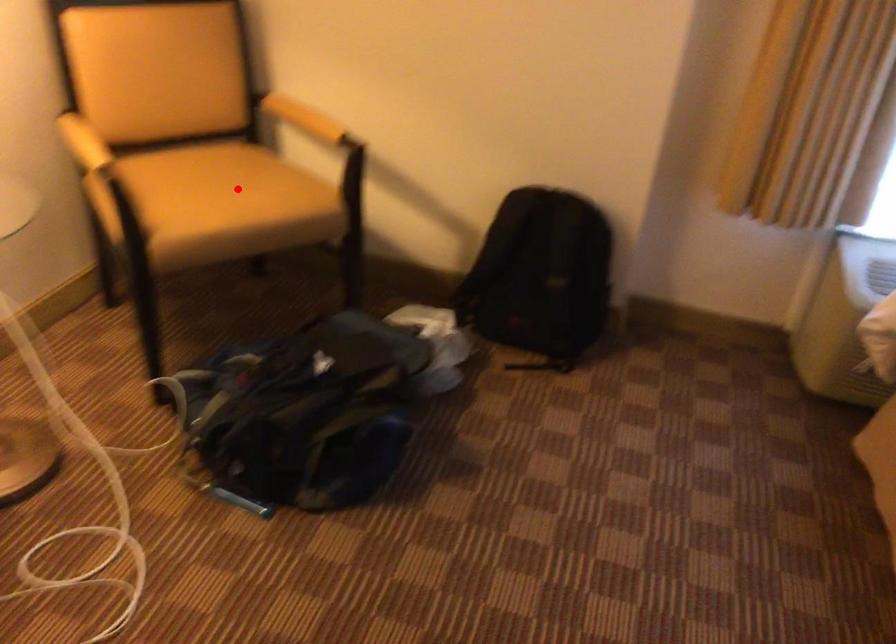
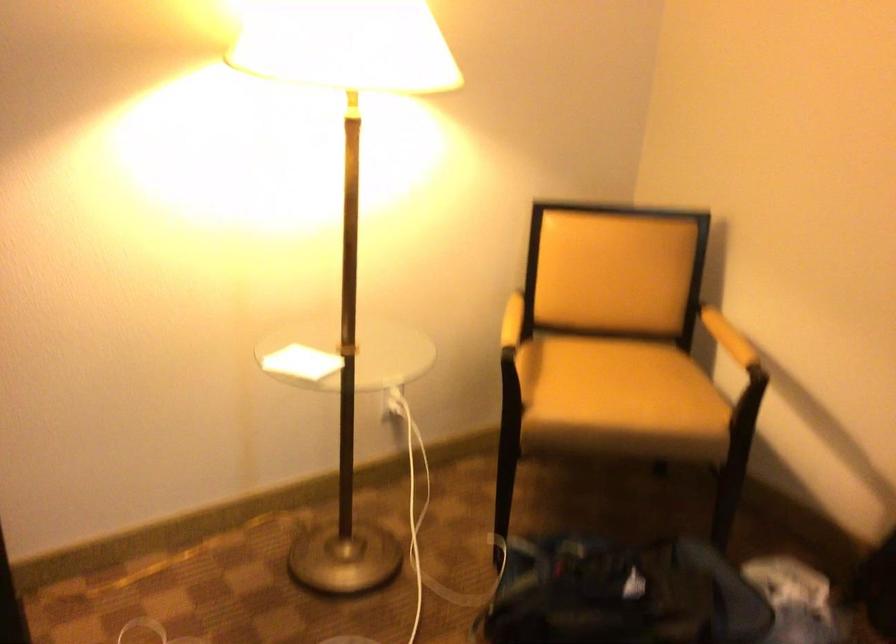
Locate, in the second image, the point that corresponds to the highlighted location in the first image.

(618, 388)